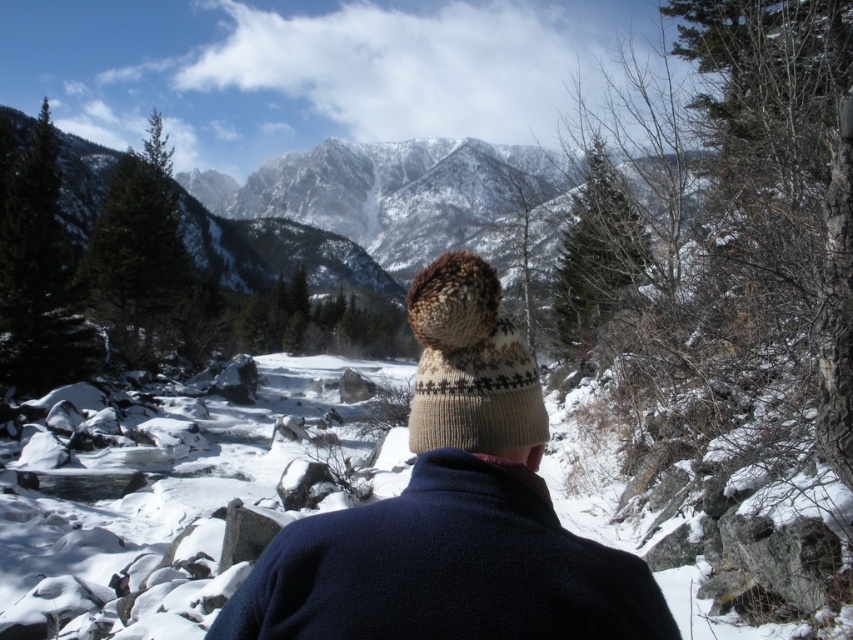
Question: Is knitted wool hat at center thinner than knitted beige hat at center?

Choices:
 (A) yes
 (B) no

Answer: (B)

Question: Which point is farther to the camera?

Choices:
 (A) (445, 252)
 (B) (488, 589)

Answer: (A)

Question: Which object appears farthest from the camera in this image?

Choices:
 (A) knitted wool hat at center
 (B) knitted beige hat at center

Answer: (B)

Question: Which point is farther to the camera?

Choices:
 (A) (534, 556)
 (B) (447, 348)

Answer: (B)

Question: Can you confirm if knitted wool hat at center is positioned below knitted beige hat at center?

Choices:
 (A) yes
 (B) no

Answer: (A)

Question: From the image, what is the correct spatial relationship of knitted wool hat at center in relation to knitted beige hat at center?

Choices:
 (A) right
 (B) left

Answer: (B)